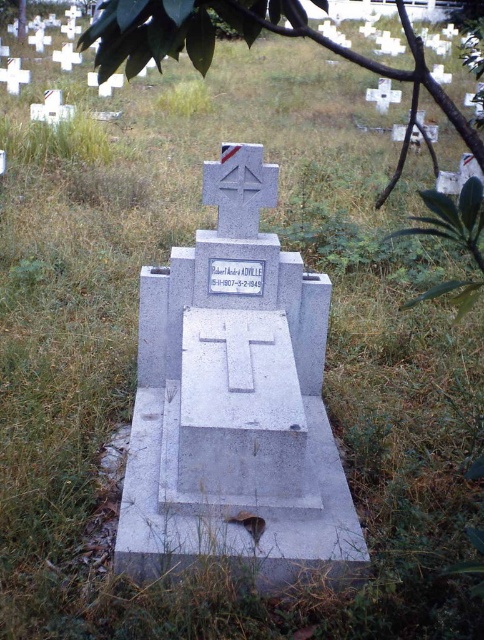
You are standing in the cemetery looking at the gray concrete cross at center and the green leafy tree at upper center. Which object is positioned to the right of the other?

The gray concrete cross at center is positioned to the right of the green leafy tree at upper center.

You are standing in the cemetery and want to place a wreath on the gray concrete cross at center. There is a green leafy tree at upper center nearby. Which object is narrower so you can easily place the wreath without obstruction?

The gray concrete cross at center has a lesser width compared to the green leafy tree at upper center, so you can easily place the wreath on the narrower gray concrete cross at center without obstruction.

You are a groundskeeper in the cemetery. You need to trim the branches of the green leafy tree at upper center to prevent them from damaging the gray concrete cross at center. Based on their positions, can you safely trim the branches without removing the tree?

The gray concrete cross at center is positioned under the green leafy tree at upper center, so trimming the branches that hang over the cross would be necessary to prevent damage while keeping the tree intact.